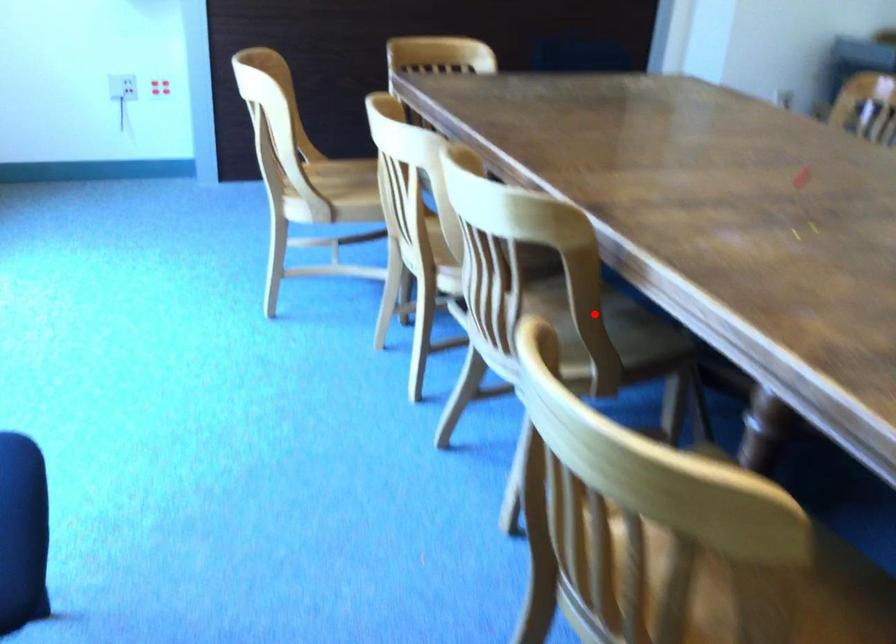
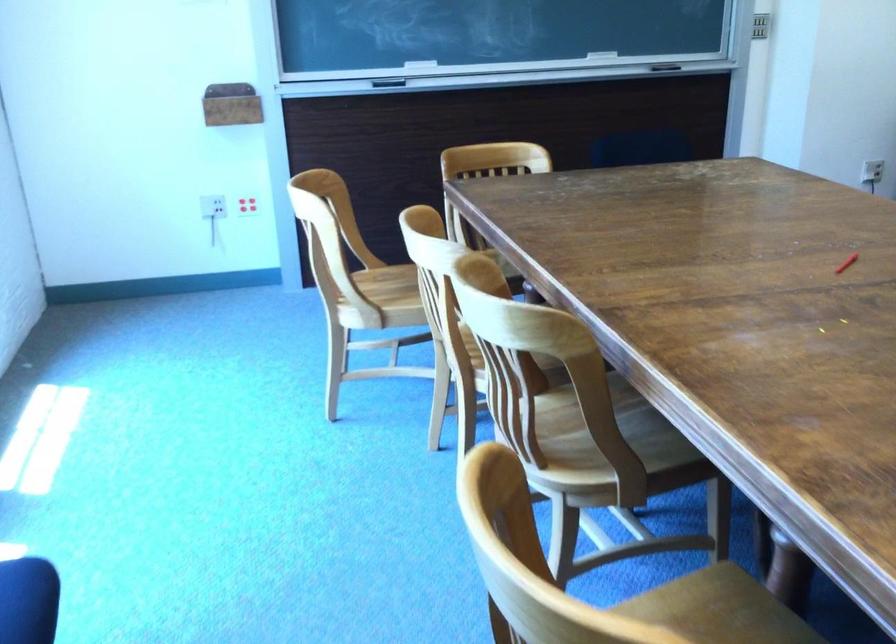
In the second image, find the point that corresponds to the highlighted location in the first image.

(606, 422)